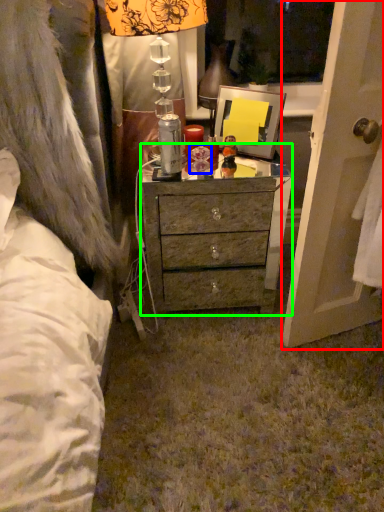
Question: Considering the real-world distances, which object is farthest from screen door (highlighted by a red box)? toy (highlighted by a blue box) or desk (highlighted by a green box)?

Choices:
 (A) toy
 (B) desk

Answer: (A)